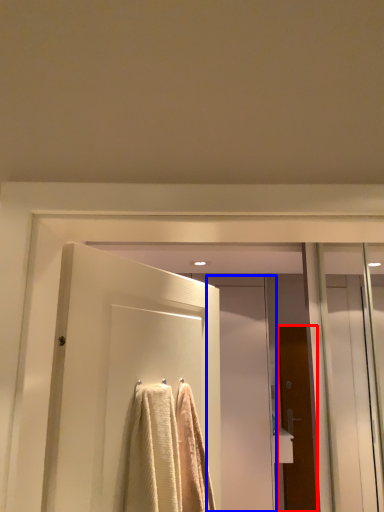
Question: Among these objects, which one is nearest to the camera, door (highlighted by a red box) or screen door (highlighted by a blue box)?

Choices:
 (A) door
 (B) screen door

Answer: (B)